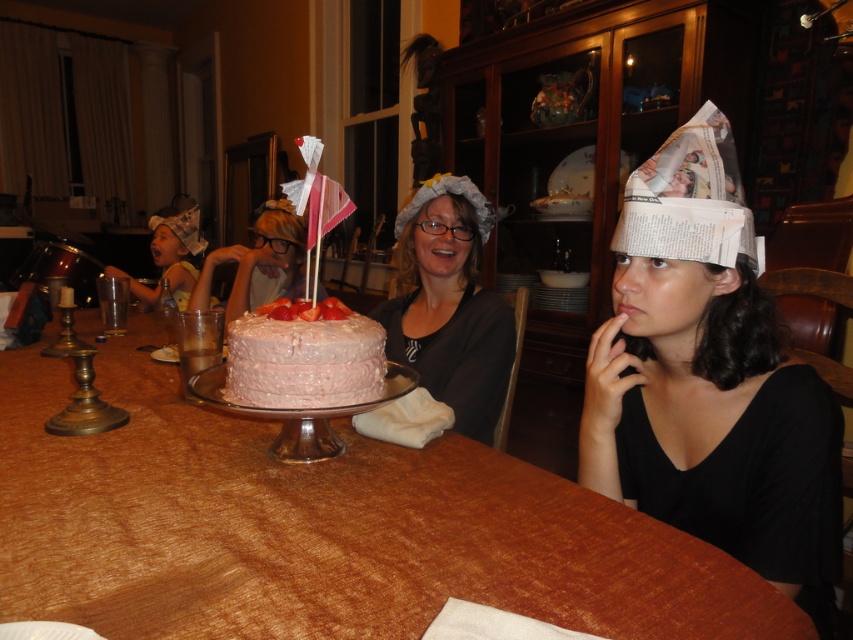
You are a guest at the family gathering and want to reach the pink frosted cake at center. Which direction should you move relative to the wooden table at center?

The wooden table at center is located below the pink frosted cake at center, so you should move upward from the wooden table at center to reach the pink frosted cake at center.

You are planning to place the white newspaper hat at center on the wooden table at center. Based on their sizes, will the hat fit entirely on the table without hanging over the edges?

The wooden table at center is wider than the white newspaper hat at center, so the hat should fit entirely on the table without any overhang.

You are at a family gathering and see the wooden table at center and the white newspaper hat at center. Which object is located to the left of the other?

The wooden table at center is positioned on the left side of white newspaper hat at center.